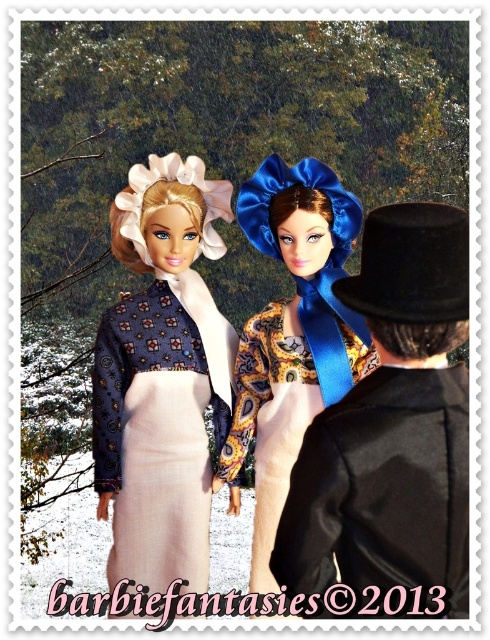
Question: Can you confirm if matte blue fabric dress at center is positioned below shiny blue satin bonnet at center?

Choices:
 (A) yes
 (B) no

Answer: (A)

Question: Which of the following is the farthest from the observer?

Choices:
 (A) (147, 216)
 (B) (323, 374)

Answer: (A)

Question: Can you confirm if matte blue fabric dress at center is bigger than shiny blue satin bonnet at center?

Choices:
 (A) yes
 (B) no

Answer: (B)

Question: Does matte blue fabric dress at center have a larger size compared to shiny blue satin bonnet at center?

Choices:
 (A) no
 (B) yes

Answer: (A)

Question: Which point is farther to the camera?

Choices:
 (A) matte blue fabric dress at center
 (B) shiny blue satin bonnet at center

Answer: (A)